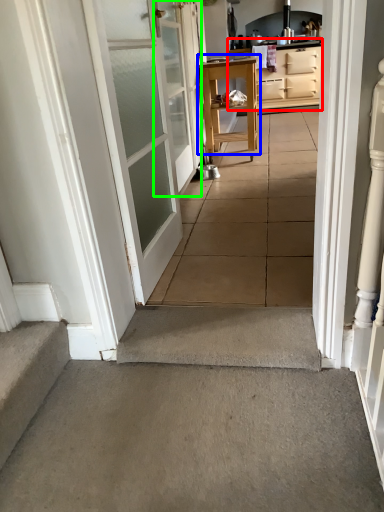
Question: Which object is the closest to the cabinetry (highlighted by a red box)? Choose among these: table (highlighted by a blue box) or door (highlighted by a green box).

Choices:
 (A) table
 (B) door

Answer: (A)